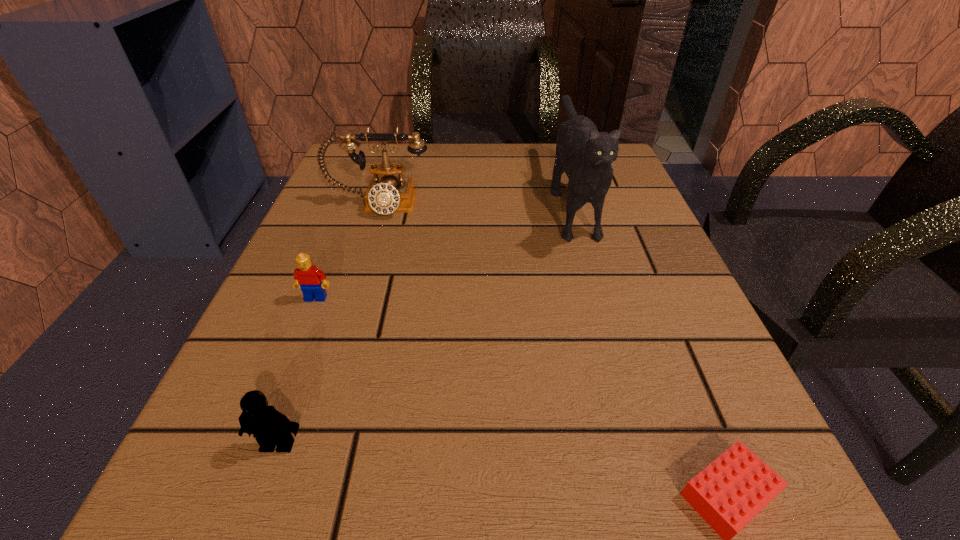
The width and height of the screenshot is (960, 540). Find the location of `cat`. cat is located at coordinates (585, 155).

You are a GUI agent. You are given a task and a screenshot of the screen. Output one action in this format:
    pyautogui.click(x=<x>, y=<y>)
    Task: Click on the fourth shortest object
    
    Given the screenshot: What is the action you would take?
    pyautogui.click(x=389, y=194)

The height and width of the screenshot is (540, 960). Identify the location of the farthest Lego. (308, 277).

Find the location of `free space located on the front-facing side of the cat`. free space located on the front-facing side of the cat is located at coordinates (603, 309).

Locate an element on the screen. vacant region located 0.190m on the dial number of the second tallest object is located at coordinates tap(350, 292).

At what (x,y) coordinates should I click in order to perform the action: click on vacant area located on the front-facing side of the farthest Lego. Please return your answer as a coordinate pair (x, y). This screenshot has width=960, height=540. Looking at the image, I should click on (255, 452).

You are a GUI agent. You are given a task and a screenshot of the screen. Output one action in this format:
    pyautogui.click(x=<x>, y=<y>)
    Task: Click on the cat at the far edge
    Image resolution: width=960 pixels, height=540 pixels.
    Given the screenshot: What is the action you would take?
    pyautogui.click(x=585, y=155)

Where is `telephone that is at the far edge`? The image size is (960, 540). telephone that is at the far edge is located at coordinates (389, 194).

This screenshot has width=960, height=540. What are the coordinates of `object that is at the near edge` in the screenshot? It's located at (271, 428).

Find the location of a particular element. telephone that is at the left edge is located at coordinates (389, 194).